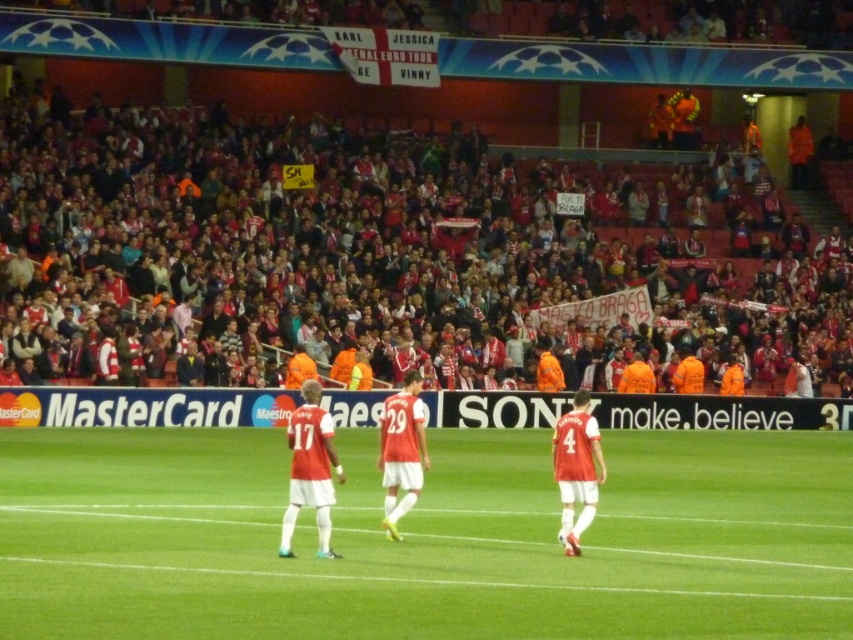
You are a drone operator assigned to capture aerial footage of the soccer match. The director wants the camera to focus on the green grass field at center. According to the coordinates provided, where should the drone fly to center the shot?

The drone should fly to the coordinates point at (x=422, y=538) to center the shot on the green grass field at center.

You are a photographer standing at the edge of the soccer field. You want to take a photo that includes both the green grass field at center and the red matte jersey at center. Which object will appear larger in your photo?

The green grass field at center will appear larger in the photo because it is closer to the viewer than the red matte jersey at center.